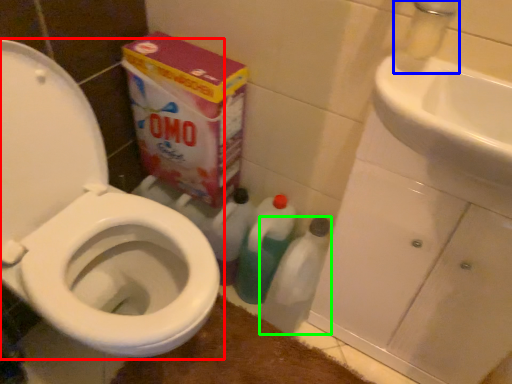
Question: Estimate the real-world distances between objects in this image. Which object is farther from toilet (highlighted by a red box), faucet (highlighted by a blue box) or cleaning product (highlighted by a green box)?

Choices:
 (A) faucet
 (B) cleaning product

Answer: (A)